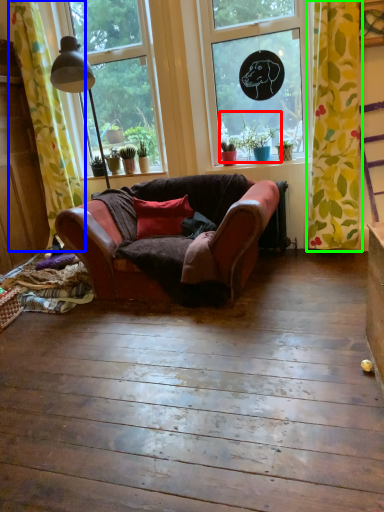
Question: Estimate the real-world distances between objects in this image. Which object is farther from plant (highlighted by a red box), curtain (highlighted by a blue box) or curtain (highlighted by a green box)?

Choices:
 (A) curtain
 (B) curtain

Answer: (A)